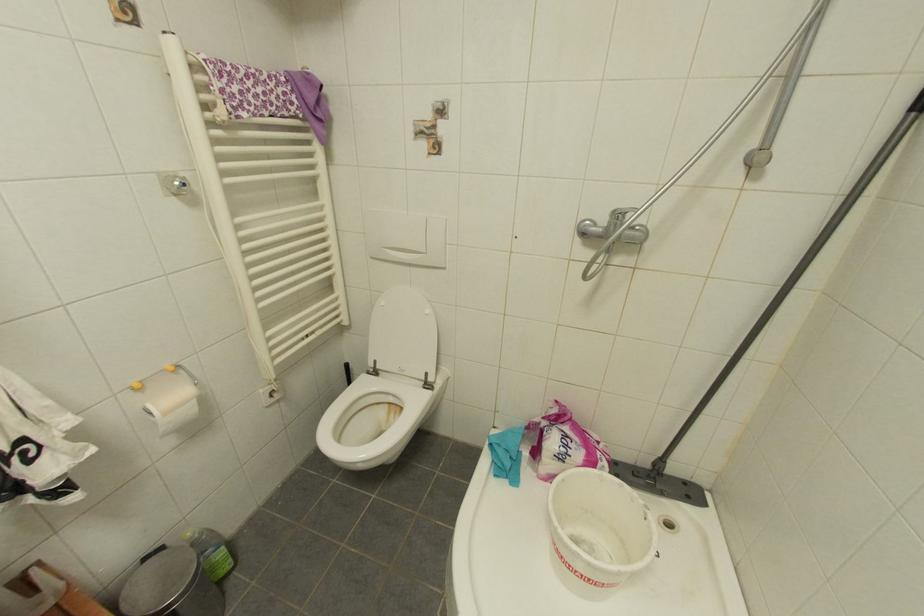
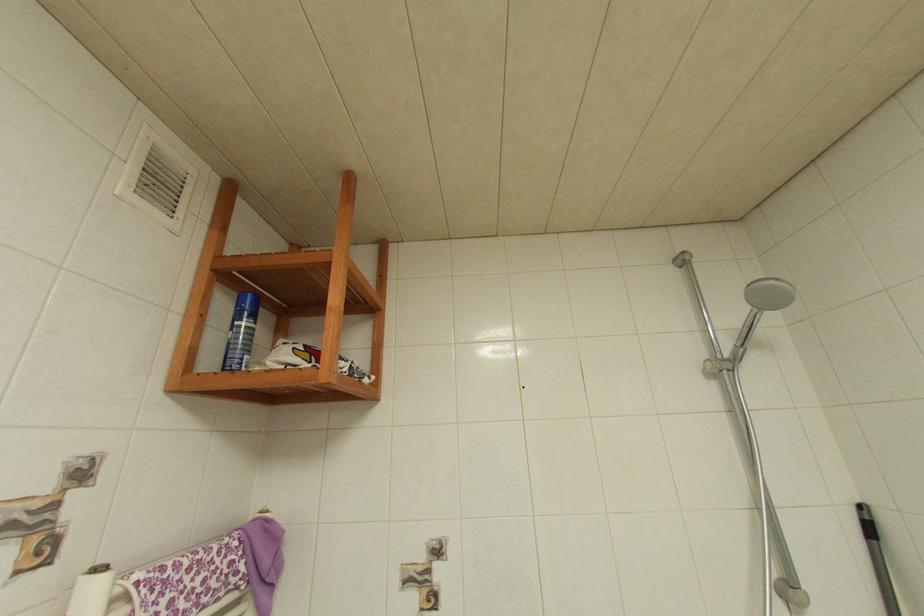
The images are taken continuously from a first-person perspective. In which direction is your viewpoint rotating?

The camera rotated toward right-up.